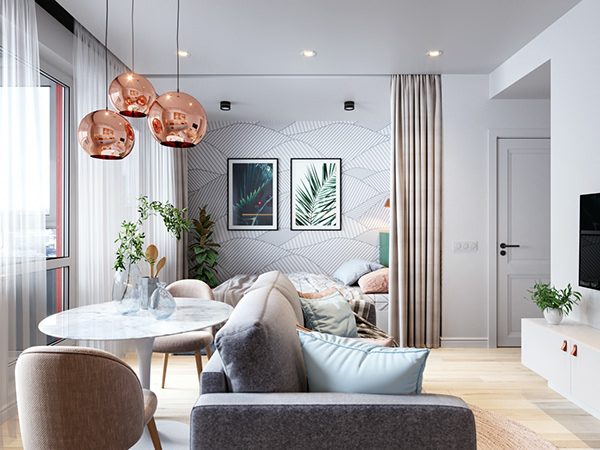
The height and width of the screenshot is (450, 600). I want to click on front door, so click(515, 195).